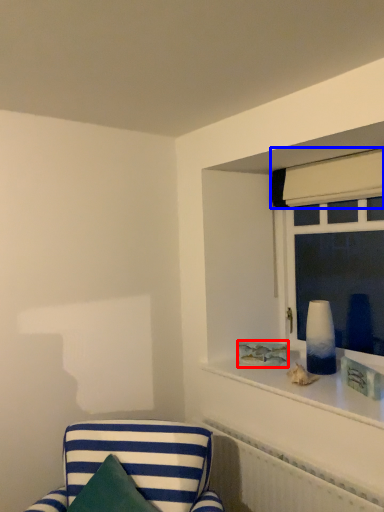
Question: Which point is closer to the camera, picture frame (highlighted by a red box) or curtain (highlighted by a blue box)?

Choices:
 (A) picture frame
 (B) curtain

Answer: (B)